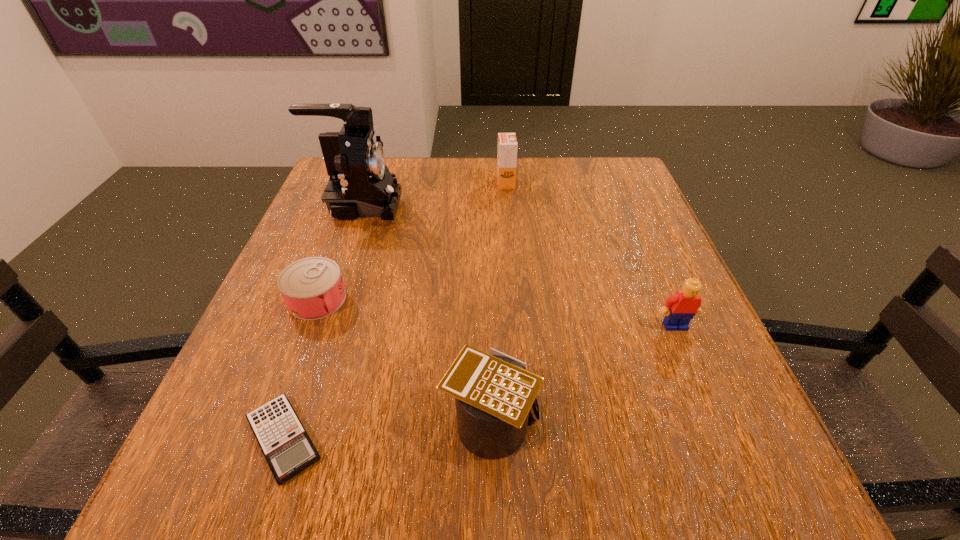
What are the coordinates of `free space that satisfies the following two spatial constraints: 1. on the back side of the taller calculator; 2. on the left side of the orange juice` in the screenshot? It's located at (487, 183).